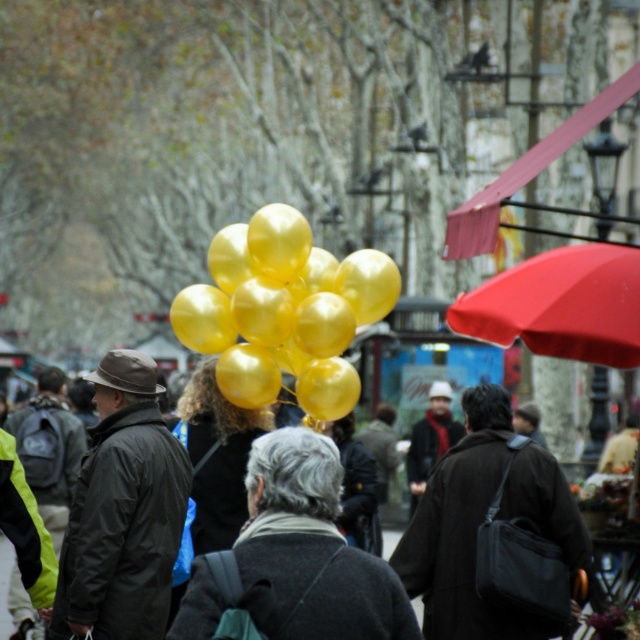
What do you see at coordinates (284, 310) in the screenshot? The width and height of the screenshot is (640, 640). I see `metallic gold balloons at center` at bounding box center [284, 310].

Who is more forward, (300, 246) or (522, 268)?

Positioned in front is point (300, 246).

Locate an element on the screen. The width and height of the screenshot is (640, 640). metallic gold balloons at center is located at coordinates (284, 310).